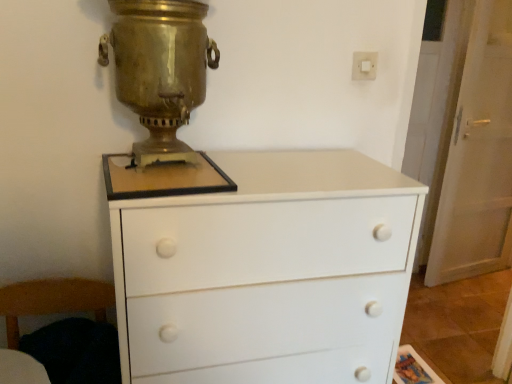
Where is `free location to the right of gold polished samovar at center`? This screenshot has width=512, height=384. free location to the right of gold polished samovar at center is located at coordinates pos(270,170).